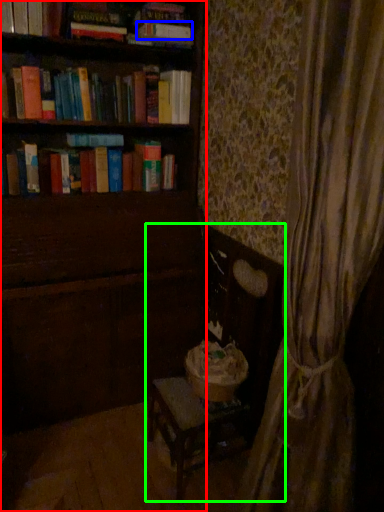
Question: Which object is the farthest from furniture (highlighted by a red box)? Choose among these: paperback book (highlighted by a blue box) or rocking chair (highlighted by a green box).

Choices:
 (A) paperback book
 (B) rocking chair

Answer: (A)